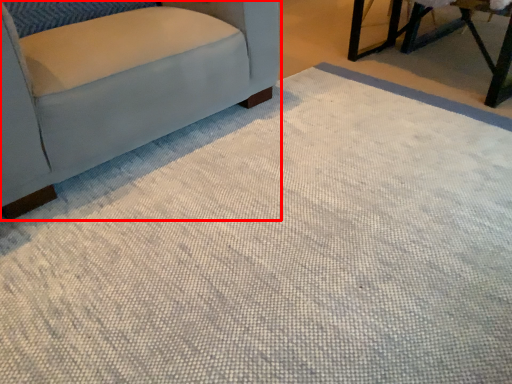
Question: Where is chair (annotated by the red box) located in relation to table in the image?

Choices:
 (A) right
 (B) left

Answer: (B)